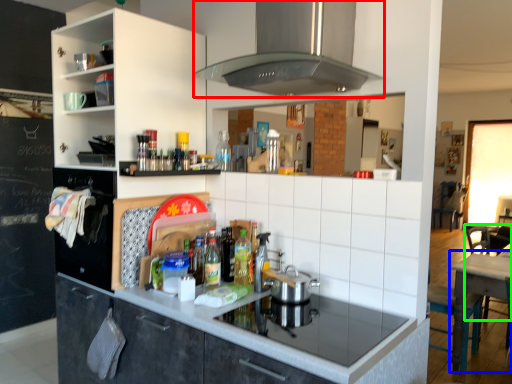
Question: Based on their relative distances, which object is farther from home appliance (highlighted by a red box)? Choose from table (highlighted by a blue box) and chair (highlighted by a green box).

Choices:
 (A) table
 (B) chair

Answer: (B)